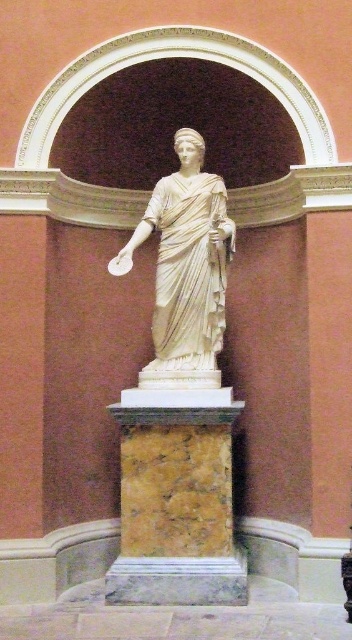
Is marble pedestal at center to the right of white marble statue at center from the viewer's perspective?

No, marble pedestal at center is not to the right of white marble statue at center.

Is point (142, 577) less distant than point (164, 292)?

Yes, point (142, 577) is closer to viewer.

Identify the location of marble pedestal at center. This screenshot has width=352, height=640. (177, 508).